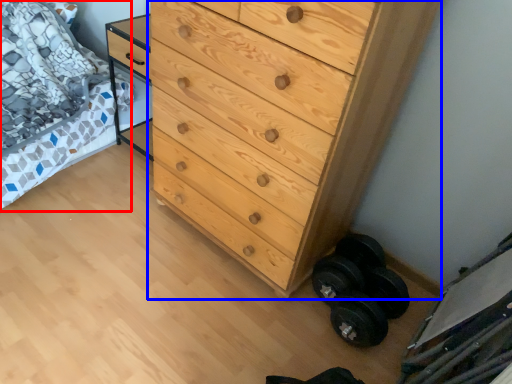
Question: Which point is closer to the camera, bed (highlighted by a red box) or chest of drawers (highlighted by a blue box)?

Choices:
 (A) bed
 (B) chest of drawers

Answer: (B)